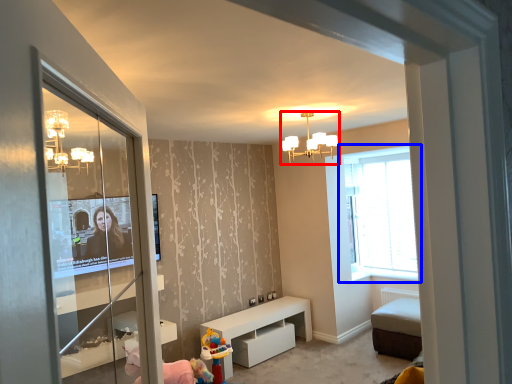
Question: Which object is closer to the camera taking this photo, light fixture (highlighted by a red box) or window (highlighted by a blue box)?

Choices:
 (A) light fixture
 (B) window

Answer: (A)